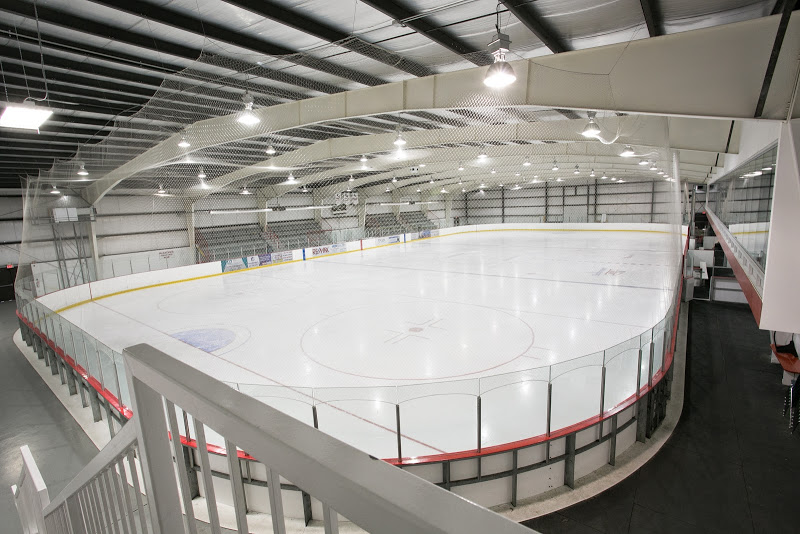
The width and height of the screenshot is (800, 534). In order to click on perspex screen in this screenshot , I will do `click(506, 423)`.